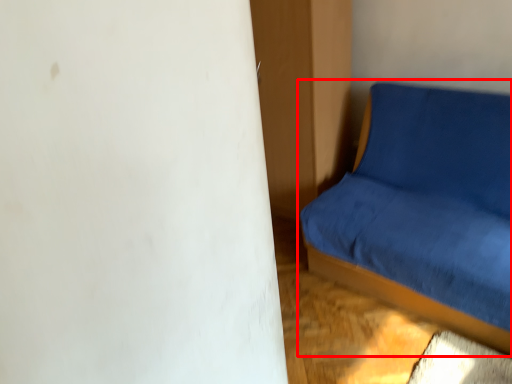
Question: From the image's perspective, what is the correct spatial positioning of studio couch (annotated by the red box) in reference to dresser?

Choices:
 (A) above
 (B) below

Answer: (B)